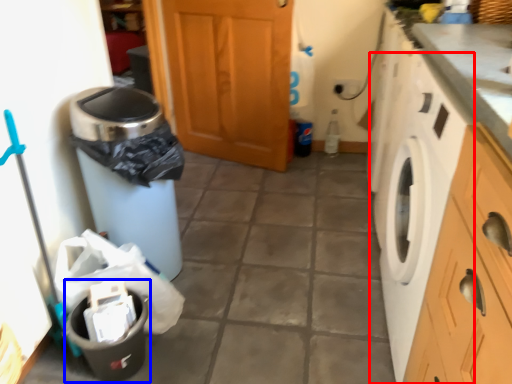
Question: Which point is closer to the camera, washing machine (highlighted by a red box) or recycling bin (highlighted by a blue box)?

Choices:
 (A) washing machine
 (B) recycling bin

Answer: (A)